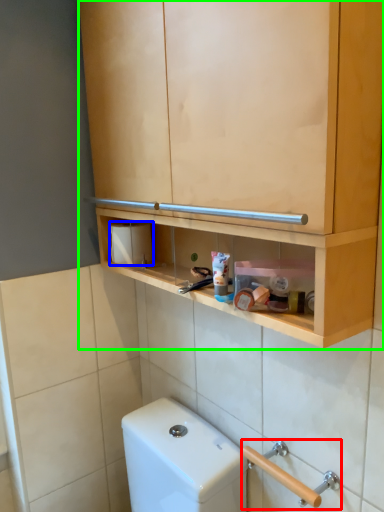
Question: Which object is the farthest from door handle (highlighted by a red box)? Choose among these: toilet paper (highlighted by a blue box) or cabinetry (highlighted by a green box).

Choices:
 (A) toilet paper
 (B) cabinetry

Answer: (B)